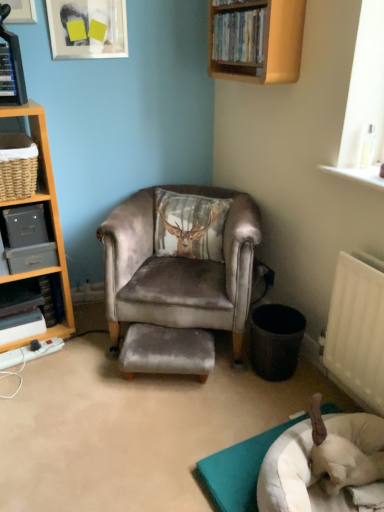
Measure the distance between wooden shelf at upper left and camera.

They are 5.85 feet apart.

What are the coordinates of `velvet grey armchair at center` in the screenshot? It's located at (179, 269).

Measure the distance between hardcover book at left, which is the 2th book in back-to-front order, and camera.

hardcover book at left, which is the 2th book in back-to-front order, and camera are 1.84 meters apart.

This screenshot has width=384, height=512. What are the coordinates of `metallic gray shelf at left, which ranks as the 1th shelf in left-to-right order` in the screenshot? It's located at (63, 300).

You are a GUI agent. You are given a task and a screenshot of the screen. Output one action in this format:
    pyautogui.click(x=<x>, y=<y>)
    Task: Click on the wooden shelf at upper left
    
    Given the screenshot: What is the action you would take?
    pyautogui.click(x=21, y=11)

Considering the sizes of objects white fabric dog bed at lower right and metallic gray file cabinet at left, the second shelf when ordered from left to right, in the image provided, who is wider, white fabric dog bed at lower right or metallic gray file cabinet at left, the second shelf when ordered from left to right,?

Wider between the two is white fabric dog bed at lower right.

Measure the distance between white fabric dog bed at lower right and metallic gray file cabinet at left, placed as the 3th shelf when sorted from right to left.

A distance of 3.85 feet exists between white fabric dog bed at lower right and metallic gray file cabinet at left, placed as the 3th shelf when sorted from right to left.

Considering the sizes of objects white fabric dog bed at lower right and metallic gray file cabinet at left, the second shelf when ordered from left to right, in the image provided, who is bigger, white fabric dog bed at lower right or metallic gray file cabinet at left, the second shelf when ordered from left to right,?

With larger size is white fabric dog bed at lower right.

Does white fabric dog bed at lower right turn towards metallic gray file cabinet at left, placed as the 3th shelf when sorted from right to left?

No.

From the image's perspective, is hardcover book at left, placed as the 2th book when sorted from front to back, above or below woven brown basket at left, acting as the third shelf starting from the left?

Clearly, from the image's perspective, hardcover book at left, placed as the 2th book when sorted from front to back, is below woven brown basket at left, acting as the third shelf starting from the left.

This screenshot has height=512, width=384. What are the coordinates of `book below the woven brown basket at left, arranged as the second shelf when viewed from the top (from a real-world perspective)` in the screenshot? It's located at (52, 298).

Between hardcover book at left, the 1th book in the back-to-front sequence, and woven brown basket at left, positioned as the 3th shelf in bottom-to-top order, which one appears on the right side from the viewer's perspective?

hardcover book at left, the 1th book in the back-to-front sequence, is more to the right.

Could you tell me if hardcover book at left, arranged as the first book when ordered from the bottom, is turned towards woven brown basket at left, positioned as the 3th shelf in bottom-to-top order?

No.

Between black plastic trash can at lower right and wooden shelf at upper center, positioned as the first shelf in top-to-bottom order, which one has less height?

Standing shorter between the two is black plastic trash can at lower right.

From the image's perspective, is black plastic trash can at lower right positioned above or below wooden shelf at upper center, positioned as the first shelf in top-to-bottom order?

Based on their image positions, black plastic trash can at lower right is located beneath wooden shelf at upper center, positioned as the first shelf in top-to-bottom order.

From the image's perspective, which shelf is the 4th one above the black plastic trash can at lower right? Please provide its 2D coordinates.

[(256, 40)]

Which is in front, point (279, 341) or point (276, 73)?

The point (276, 73) is closer to the camera.

Based on the photo, based on their positions, is wooden shelf at upper left located to the left or right of black plastic trash can at lower right?

In the image, wooden shelf at upper left appears on the left side of black plastic trash can at lower right.

Considering the sizes of objects wooden shelf at upper left and black plastic trash can at lower right in the image provided, who is bigger, wooden shelf at upper left or black plastic trash can at lower right?

black plastic trash can at lower right.

From the image's perspective, which one is positioned higher, wooden shelf at upper left or black plastic trash can at lower right?

wooden shelf at upper left is shown above in the image.

Is wooden shelf at upper left looking in the opposite direction of black plastic trash can at lower right?

No, wooden shelf at upper left is not facing the opposite direction of black plastic trash can at lower right.

From a real-world perspective, is wooden shelf at upper center, the 4th shelf positioned from the bottom, physically below metallic gray shelf at left, the 4th shelf when ordered from right to left?

Incorrect, from a real-world perspective, wooden shelf at upper center, the 4th shelf positioned from the bottom, is higher than metallic gray shelf at left, the 4th shelf when ordered from right to left.

You are a GUI agent. You are given a task and a screenshot of the screen. Output one action in this format:
    pyautogui.click(x=<x>, y=<y>)
    Task: Click on the 3rd shelf located beneath the wooden shelf at upper center, marked as the 4th shelf in a left-to-right arrangement (from a real-world perspective)
    The width and height of the screenshot is (384, 512).
    Given the screenshot: What is the action you would take?
    pyautogui.click(x=63, y=300)

Is point (211, 71) closer to viewer compared to point (69, 330)?

Yes.

Between wooden shelf at upper center, the 1th shelf in the right-to-left sequence, and metallic gray shelf at left, which is the first shelf from bottom to top, which one appears on the right side from the viewer's perspective?

From the viewer's perspective, wooden shelf at upper center, the 1th shelf in the right-to-left sequence, appears more on the right side.

Does black plastic trash can at lower right have a lesser width compared to metallic gray file cabinet at left, which is the 3th shelf in top-to-bottom order?

Yes, black plastic trash can at lower right is thinner than metallic gray file cabinet at left, which is the 3th shelf in top-to-bottom order.

Is metallic gray file cabinet at left, which is the 3th shelf in top-to-bottom order, a part of black plastic trash can at lower right?

Definitely not — metallic gray file cabinet at left, which is the 3th shelf in top-to-bottom order, is not inside black plastic trash can at lower right.

Is point (289, 345) closer to camera compared to point (8, 233)?

Yes, point (289, 345) is closer to viewer.

Measure the distance between velvet grey armchair at center and wooden shelf at upper center, the 4th shelf positioned from the bottom.

velvet grey armchair at center is 31.40 inches away from wooden shelf at upper center, the 4th shelf positioned from the bottom.

Which is in front, velvet grey armchair at center or wooden shelf at upper center, the 1th shelf in the right-to-left sequence?

wooden shelf at upper center, the 1th shelf in the right-to-left sequence, is more forward.

Which point is more distant from viewer, (133, 200) or (267, 38)?

The point (133, 200) is farther from the camera.

This screenshot has width=384, height=512. I want to click on the 3rd shelf to the left when counting from the white fabric dog bed at lower right, so click(x=27, y=238).

From a real-world perspective, count 3rd shelfs upward from the hardcover book at left, placed as the 2th book when sorted from front to back, and point to it. Please provide its 2D coordinates.

[(37, 144)]

Estimate the real-world distances between objects in this image. Which object is further from metallic silver picture frame at upper left, metallic gray shelf at left, which ranks as the 1th shelf in left-to-right order, or hardcover book at left, acting as the 2th book starting from the bottom?

metallic gray shelf at left, which ranks as the 1th shelf in left-to-right order, is further to metallic silver picture frame at upper left.

When comparing their distances from metallic silver picture frame at upper left, does black plastic trash can at lower right or hardcover book at left, the 1th book in the back-to-front sequence, seem closer?

Among the two, hardcover book at left, the 1th book in the back-to-front sequence, is located nearer to metallic silver picture frame at upper left.

Based on the photo, considering their positions, is hardcover book at left, the 1th book in the back-to-front sequence, positioned closer to white fabric dog bed at lower right than metallic silver picture frame at upper left?

hardcover book at left, the 1th book in the back-to-front sequence, is closer to white fabric dog bed at lower right.

Estimate the real-world distances between objects in this image. Which object is closer to metallic gray file cabinet at left, the second shelf when ordered from left to right, metallic gray shelf at left, which ranks as the 1th shelf in left-to-right order, or black plastic trash can at lower right?

metallic gray shelf at left, which ranks as the 1th shelf in left-to-right order, is closer to metallic gray file cabinet at left, the second shelf when ordered from left to right.

Which object lies nearer to the anchor point wooden shelf at upper center, the 4th shelf positioned from the bottom, white fabric dog bed at lower right or metallic silver picture frame at upper left?

metallic silver picture frame at upper left is positioned closer to the anchor wooden shelf at upper center, the 4th shelf positioned from the bottom.

Based on their spatial positions, is wooden shelf at upper left or hardcover book at left, acting as the 2th book starting from the bottom, further from velvet grey stool at center?

Based on the image, wooden shelf at upper left appears to be further to velvet grey stool at center.

Considering their positions, is hardcover book at left, the second book when ordered from top to bottom, positioned closer to black plastic trash can at lower right than wooden shelf at upper center, marked as the 4th shelf in a left-to-right arrangement?

hardcover book at left, the second book when ordered from top to bottom, is closer to black plastic trash can at lower right.

From the image, which object appears to be farther from metallic silver picture frame at upper left, black plastic trash can at lower right or metallic gray file cabinet at left, the second shelf ordered from the bottom?

The object further to metallic silver picture frame at upper left is black plastic trash can at lower right.

Find the location of a particular element. The width and height of the screenshot is (384, 512). shelf between metallic gray file cabinet at left, the second shelf when ordered from left to right, and velvet grey armchair at center is located at coordinates (37, 144).

You are a GUI agent. You are given a task and a screenshot of the screen. Output one action in this format:
    pyautogui.click(x=<x>, y=<y>)
    Task: Click on the stool situated between metallic gray file cabinet at left, placed as the 3th shelf when sorted from right to left, and white fabric dog bed at lower right from left to right
    
    Given the screenshot: What is the action you would take?
    pyautogui.click(x=167, y=351)

Where is `shelf that lies between hardcover book at left, the first book from the top, and metallic gray file cabinet at left, the second shelf when ordered from left to right, from top to bottom`? The height and width of the screenshot is (512, 384). shelf that lies between hardcover book at left, the first book from the top, and metallic gray file cabinet at left, the second shelf when ordered from left to right, from top to bottom is located at coordinates (37, 144).

Locate an element on the screen. trash bin/can between white fabric dog bed at lower right and velvet grey stool at center along the z-axis is located at coordinates (276, 341).